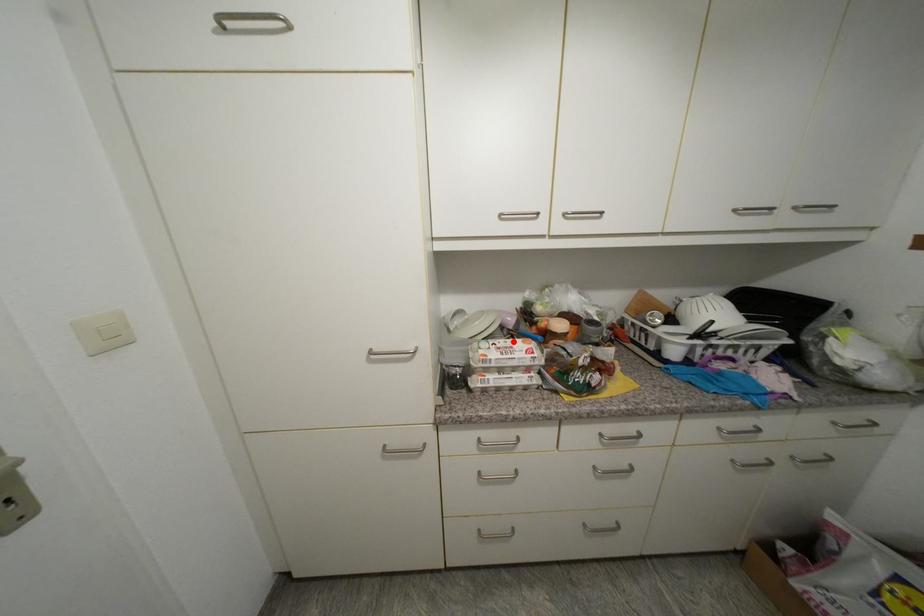
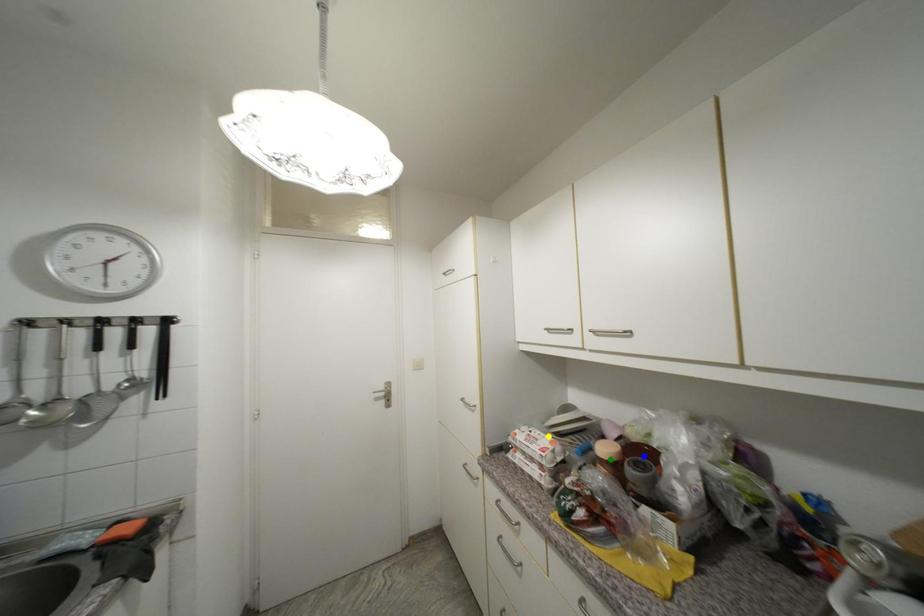
Question: I am providing you with two images of the same scene from different viewpoints. A red point is marked on the first image. You are given multiple points on the second image. In image 2, which mark is for the same physical point as the one in image 1?

Choices:
 (A) green point
 (B) yellow point
 (C) blue point

Answer: (B)